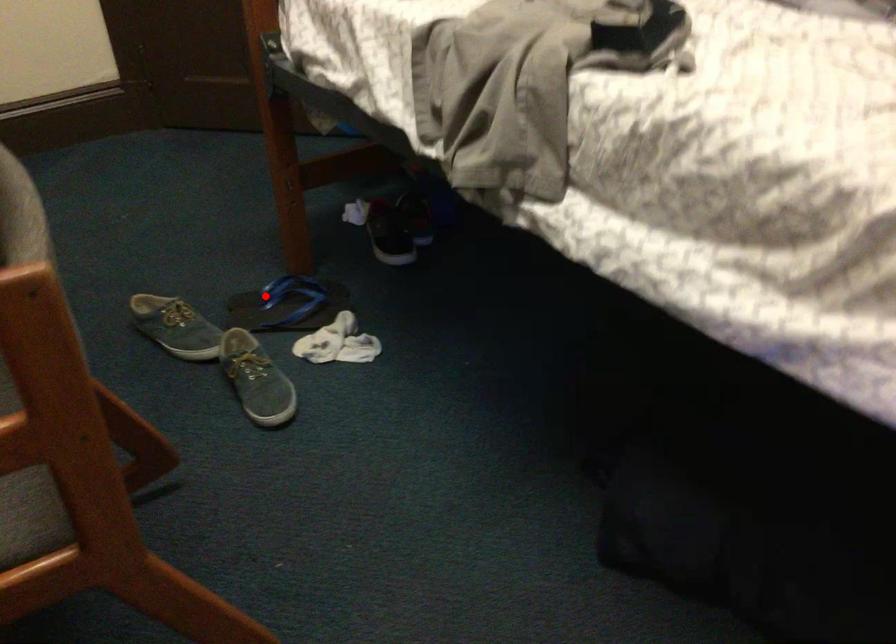
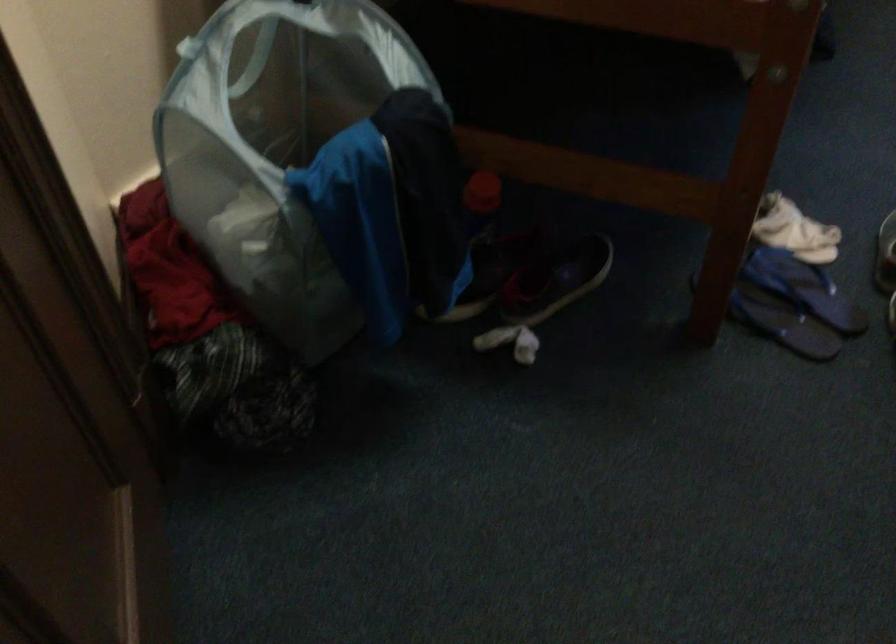
Locate, in the second image, the point that corresponds to the highlighted location in the first image.

(782, 323)